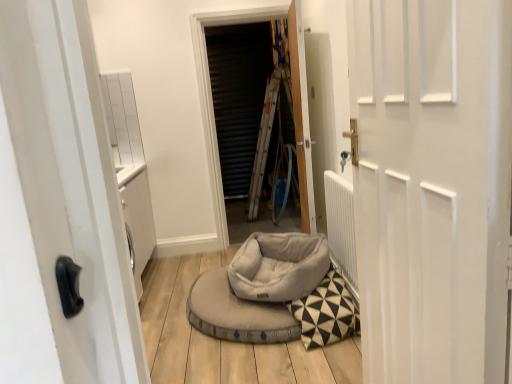
Question: Are wooden door at center, positioned as the 2th door in front-to-back order, and soft gray fabric bean bag at center located far from each other?

Choices:
 (A) yes
 (B) no

Answer: (B)

Question: Is wooden door at center, positioned as the 2th door in front-to-back order, further to the viewer compared to soft gray fabric bean bag at center?

Choices:
 (A) no
 (B) yes

Answer: (B)

Question: Is wooden door at center, positioned as the 2th door in front-to-back order, to the left of soft gray fabric bean bag at center from the viewer's perspective?

Choices:
 (A) no
 (B) yes

Answer: (A)

Question: Could you tell me if wooden door at center, the first door viewed from the back, is turned towards soft gray fabric bean bag at center?

Choices:
 (A) yes
 (B) no

Answer: (B)

Question: From a real-world perspective, is wooden door at center, positioned as the 2th door in front-to-back order, on soft gray fabric bean bag at center?

Choices:
 (A) yes
 (B) no

Answer: (A)

Question: Considering the relative positions of wooden door at center, positioned as the 2th door in front-to-back order, and soft gray fabric bean bag at center in the image provided, is wooden door at center, positioned as the 2th door in front-to-back order, to the right of soft gray fabric bean bag at center from the viewer's perspective?

Choices:
 (A) yes
 (B) no

Answer: (A)

Question: Does wooden door at center, positioned as the 2th door in front-to-back order, appear on the right side of metallic silver screen at center?

Choices:
 (A) no
 (B) yes

Answer: (B)

Question: Would you say wooden door at center, positioned as the 2th door in front-to-back order, is outside metallic silver screen at center?

Choices:
 (A) no
 (B) yes

Answer: (B)

Question: From the image's perspective, is wooden door at center, the first door viewed from the back, below metallic silver screen at center?

Choices:
 (A) no
 (B) yes

Answer: (B)

Question: From the image's perspective, is wooden door at center, the first door viewed from the back, above metallic silver screen at center?

Choices:
 (A) yes
 (B) no

Answer: (B)

Question: Does wooden door at center, positioned as the 2th door in front-to-back order, lie behind metallic silver screen at center?

Choices:
 (A) no
 (B) yes

Answer: (A)

Question: Is wooden door at center, positioned as the 2th door in front-to-back order, positioned far away from metallic silver screen at center?

Choices:
 (A) no
 (B) yes

Answer: (A)

Question: Could white matte door at center, which is counted as the 1th door, starting from the front, be considered to be inside metallic silver screen at center?

Choices:
 (A) no
 (B) yes

Answer: (A)